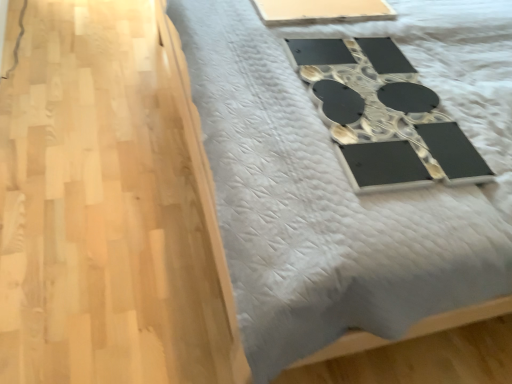
Question: Does black glossy mirror at upper center have a smaller size compared to white plastic tray at upper center?

Choices:
 (A) yes
 (B) no

Answer: (B)

Question: Is black glossy mirror at upper center placed right next to white plastic tray at upper center?

Choices:
 (A) yes
 (B) no

Answer: (B)

Question: Can you confirm if black glossy mirror at upper center is shorter than white plastic tray at upper center?

Choices:
 (A) no
 (B) yes

Answer: (A)

Question: From a real-world perspective, is black glossy mirror at upper center below white plastic tray at upper center?

Choices:
 (A) yes
 (B) no

Answer: (A)

Question: Is white plastic tray at upper center surrounded by black glossy mirror at upper center?

Choices:
 (A) yes
 (B) no

Answer: (B)

Question: Can you confirm if black glossy mirror at upper center is positioned to the left of white plastic tray at upper center?

Choices:
 (A) no
 (B) yes

Answer: (B)

Question: Is the position of white plastic tray at upper center less distant than that of black glossy mirror at upper center?

Choices:
 (A) no
 (B) yes

Answer: (A)

Question: From a real-world perspective, does white plastic tray at upper center stand above black glossy mirror at upper center?

Choices:
 (A) yes
 (B) no

Answer: (A)

Question: Considering the relative sizes of white plastic tray at upper center and black glossy mirror at upper center in the image provided, is white plastic tray at upper center shorter than black glossy mirror at upper center?

Choices:
 (A) yes
 (B) no

Answer: (A)

Question: Is white plastic tray at upper center positioned beyond the bounds of black glossy mirror at upper center?

Choices:
 (A) yes
 (B) no

Answer: (A)

Question: Is white plastic tray at upper center surrounding black glossy mirror at upper center?

Choices:
 (A) no
 (B) yes

Answer: (A)

Question: Can you confirm if white plastic tray at upper center is smaller than black glossy mirror at upper center?

Choices:
 (A) no
 (B) yes

Answer: (B)

Question: Considering the relative positions of white plastic tray at upper center and black glossy mirror at upper center in the image provided, is white plastic tray at upper center to the left or to the right of black glossy mirror at upper center?

Choices:
 (A) left
 (B) right

Answer: (B)